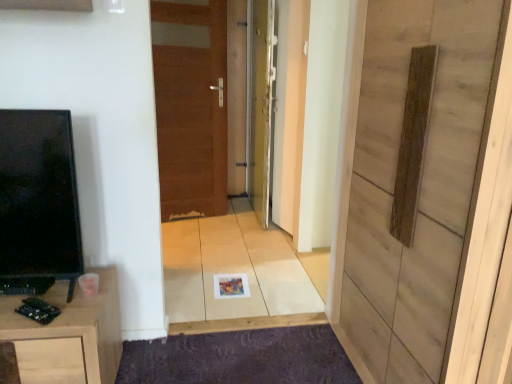
Question: Considering the relative sizes of wooden cabinet at lower left and brown wooden door at center, positioned as the 3th door in right-to-left order, in the image provided, is wooden cabinet at lower left taller than brown wooden door at center, positioned as the 3th door in right-to-left order,?

Choices:
 (A) no
 (B) yes

Answer: (A)

Question: Is wooden cabinet at lower left in contact with brown wooden door at center, placed as the third door when sorted from front to back?

Choices:
 (A) yes
 (B) no

Answer: (B)

Question: Is wooden cabinet at lower left not close to brown wooden door at center, which is the 1th door in left-to-right order?

Choices:
 (A) no
 (B) yes

Answer: (B)

Question: Is wooden cabinet at lower left to the right of brown wooden door at center, positioned as the 3th door in right-to-left order, from the viewer's perspective?

Choices:
 (A) yes
 (B) no

Answer: (B)

Question: Does wooden cabinet at lower left turn towards brown wooden door at center, positioned as the 1th door in back-to-front order?

Choices:
 (A) yes
 (B) no

Answer: (B)

Question: Which is correct: wooden panel at center, which is counted as the third door, starting from the back, is inside brown wooden door at center, placed as the third door when sorted from front to back, or outside of it?

Choices:
 (A) outside
 (B) inside

Answer: (A)

Question: From a real-world perspective, is wooden panel at center, the first door when ordered from right to left, positioned above or below brown wooden door at center, positioned as the 3th door in right-to-left order?

Choices:
 (A) above
 (B) below

Answer: (B)

Question: From the image's perspective, is wooden panel at center, which is the 3th door from left to right, positioned above or below brown wooden door at center, positioned as the 1th door in back-to-front order?

Choices:
 (A) above
 (B) below

Answer: (B)

Question: From their relative heights in the image, would you say wooden panel at center, which is counted as the third door, starting from the back, is taller or shorter than brown wooden door at center, placed as the third door when sorted from front to back?

Choices:
 (A) short
 (B) tall

Answer: (A)

Question: Looking at their shapes, would you say purple textured mat at lower center is wider or thinner than wooden panel at center, which is counted as the third door, starting from the back?

Choices:
 (A) wide
 (B) thin

Answer: (B)

Question: From their relative heights in the image, would you say purple textured mat at lower center is taller or shorter than wooden panel at center, the first door when ordered from right to left?

Choices:
 (A) short
 (B) tall

Answer: (A)

Question: Does point (167, 382) appear closer or farther from the camera than point (396, 281)?

Choices:
 (A) closer
 (B) farther

Answer: (B)

Question: From the image's perspective, is purple textured mat at lower center located above or below wooden panel at center, which is counted as the third door, starting from the back?

Choices:
 (A) below
 (B) above

Answer: (A)

Question: Considering the positions of point (293, 326) and point (261, 213), is point (293, 326) closer or farther from the camera than point (261, 213)?

Choices:
 (A) closer
 (B) farther

Answer: (A)

Question: Visually, is purple textured mat at lower center positioned to the left or to the right of metallic silver door at center, which is the second door in left-to-right order?

Choices:
 (A) right
 (B) left

Answer: (B)